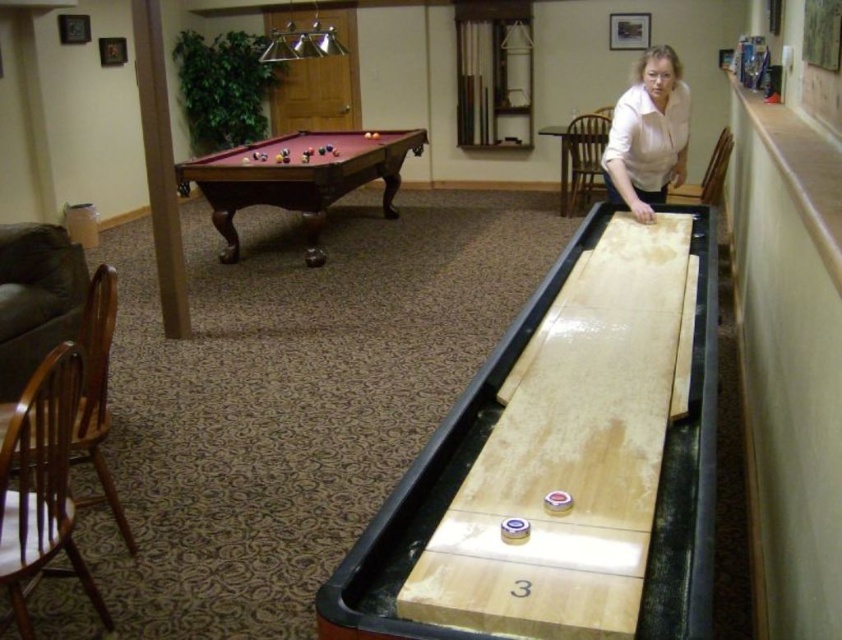
You are standing at the entrance of the recreational room and want to place a new pool table in the same location as the existing light brown wood billiard table at center. What are the coordinates where you should position it?

The light brown wood billiard table at center is located at point (430, 486), so you should position the new pool table at those coordinates to match the existing setup.

You are a delivery person trying to bring a large package through the doorway near the mahogany wood billiard table at left. The package is as wide as the white smooth shirt at upper right. Will the package fit through the doorway?

The mahogany wood billiard table at left is wider than the white smooth shirt at upper right. Since the package is as wide as the white smooth shirt at upper right, it should fit through the doorway as the table itself is positioned near the doorway and its greater width implies the doorway is at least that wide.